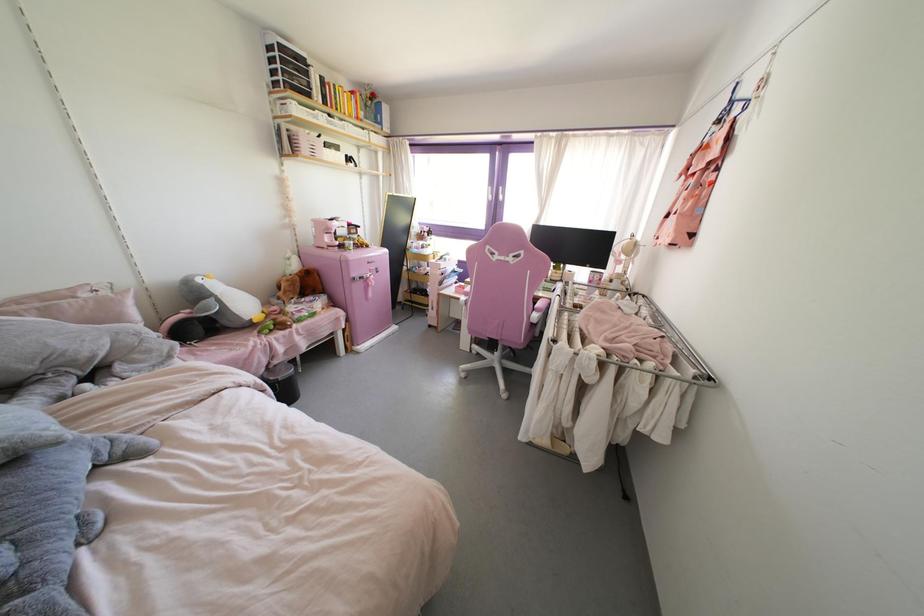
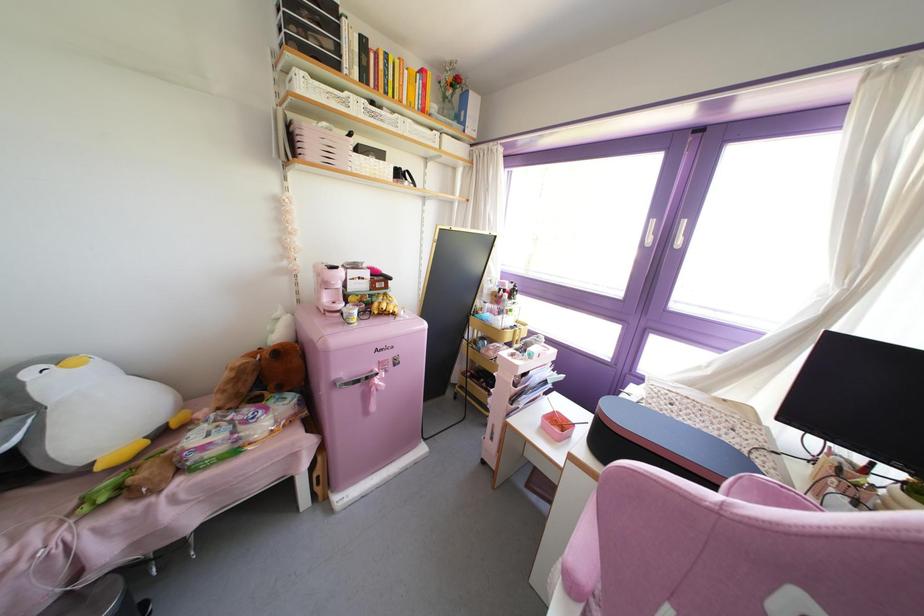
In the second image, find the point that corresponds to point (333, 151) in the first image.

(371, 160)